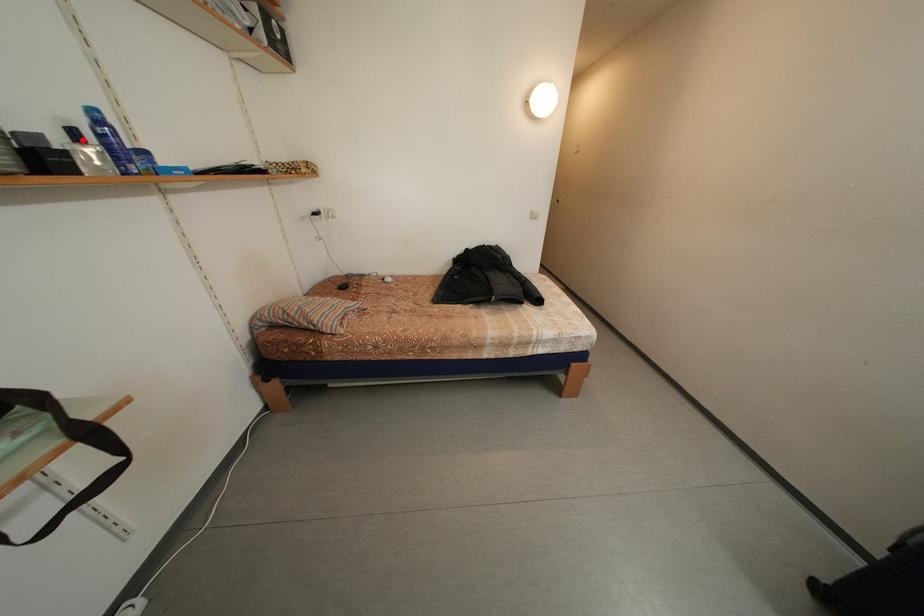
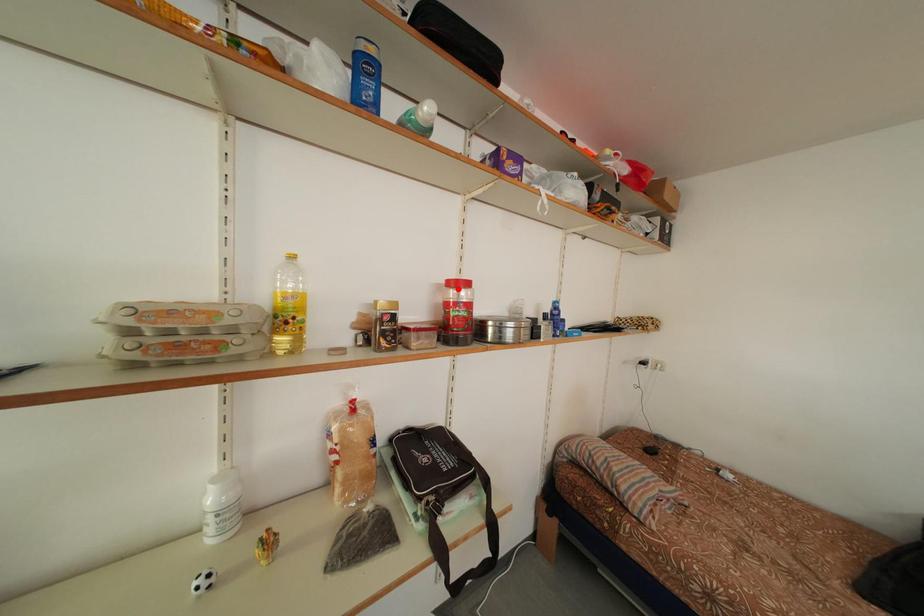
I am providing you with two images of the same scene from different viewpoints. A red point is marked on the first image and another point is marked on the second image. Do the highlighted points in image1 and image2 indicate the same real-world spot?

No